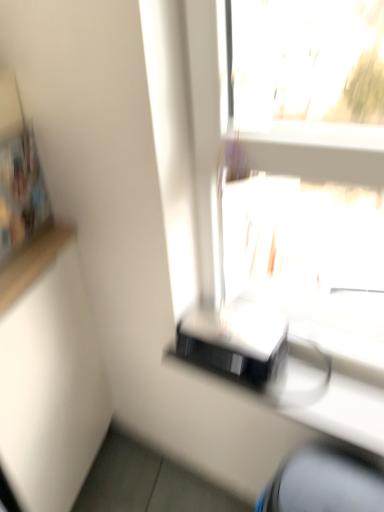
Describe the element at coordinates (346, 413) in the screenshot. I see `black glossy printer at lower right` at that location.

I want to click on black glossy printer at lower right, so [x=346, y=413].

Measure the distance between black glossy printer at lower right and camera.

They are 36.99 inches apart.

What do you see at coordinates (324, 483) in the screenshot? I see `blue fabric computer chair at lower right` at bounding box center [324, 483].

Where is `blue fabric computer chair at lower right`? blue fabric computer chair at lower right is located at coordinates (324, 483).

You are a GUI agent. You are given a task and a screenshot of the screen. Output one action in this format:
    pyautogui.click(x=<x>, y=<y>)
    Task: Click on the black glossy printer at lower right
    
    Given the screenshot: What is the action you would take?
    pyautogui.click(x=346, y=413)

Which is more to the left, blue fabric computer chair at lower right or black glossy printer at lower right?

black glossy printer at lower right.

Is blue fabric computer chair at lower right in front of or behind black glossy printer at lower right in the image?

Clearly, blue fabric computer chair at lower right is in front of black glossy printer at lower right.

Which point is more distant from viewer, [315,469] or [335,409]?

The point [335,409] is farther from the camera.

From the image's perspective, which one is positioned higher, blue fabric computer chair at lower right or black glossy printer at lower right?

From the image's view, black glossy printer at lower right is above.

From a real-world perspective, which object rests below the other?

From a 3D spatial view, blue fabric computer chair at lower right is below.

Does blue fabric computer chair at lower right have a greater width compared to black glossy printer at lower right?

Yes.

Who is taller, blue fabric computer chair at lower right or black glossy printer at lower right?

With more height is blue fabric computer chair at lower right.

Who is bigger, blue fabric computer chair at lower right or black glossy printer at lower right?

blue fabric computer chair at lower right is bigger.

Which is correct: blue fabric computer chair at lower right is inside black glossy printer at lower right, or outside of it?

blue fabric computer chair at lower right cannot be found inside black glossy printer at lower right.

Can you see blue fabric computer chair at lower right touching black glossy printer at lower right?

blue fabric computer chair at lower right and black glossy printer at lower right are clearly separated.

Looking at this image, is blue fabric computer chair at lower right oriented towards black glossy printer at lower right?

No, blue fabric computer chair at lower right is not oriented towards black glossy printer at lower right.

What's the angular difference between blue fabric computer chair at lower right and black glossy printer at lower right's facing directions?

The facing directions of blue fabric computer chair at lower right and black glossy printer at lower right are 0.679 degrees apart.

This screenshot has height=512, width=384. I want to click on computer chair below the black glossy printer at lower right (from the image's perspective), so click(324, 483).

Would you say black glossy printer at lower right is to the left or to the right of blue fabric computer chair at lower right in the picture?

Based on their positions, black glossy printer at lower right is located to the left of blue fabric computer chair at lower right.

Between black glossy printer at lower right and blue fabric computer chair at lower right, which one is positioned in front?

blue fabric computer chair at lower right is closer to the camera.

Considering the points (173, 358) and (303, 461), which point is behind, point (173, 358) or point (303, 461)?

The point (173, 358) is behind.

From the image's perspective, between black glossy printer at lower right and blue fabric computer chair at lower right, who is located below?

blue fabric computer chair at lower right.

From a real-world perspective, is black glossy printer at lower right on top of blue fabric computer chair at lower right?

Indeed, from a real-world perspective, black glossy printer at lower right stands above blue fabric computer chair at lower right.

Does black glossy printer at lower right have a lesser width compared to blue fabric computer chair at lower right?

Yes, black glossy printer at lower right is thinner than blue fabric computer chair at lower right.

Which of these two, black glossy printer at lower right or blue fabric computer chair at lower right, stands taller?

Standing taller between the two is blue fabric computer chair at lower right.

Is black glossy printer at lower right smaller than blue fabric computer chair at lower right?

Indeed, black glossy printer at lower right has a smaller size compared to blue fabric computer chair at lower right.

Is blue fabric computer chair at lower right completely or partially inside black glossy printer at lower right?

No, black glossy printer at lower right does not contain blue fabric computer chair at lower right.

Are black glossy printer at lower right and blue fabric computer chair at lower right located far from each other?

No.

Is black glossy printer at lower right looking in the opposite direction of blue fabric computer chair at lower right?

No, black glossy printer at lower right is not facing away from blue fabric computer chair at lower right.

This screenshot has height=512, width=384. I want to click on computer chair below the black glossy printer at lower right (from the image's perspective), so click(x=324, y=483).

Identify the location of computer chair below the black glossy printer at lower right (from a real-world perspective). (324, 483).

Where is `counter behind the blue fabric computer chair at lower right`? This screenshot has height=512, width=384. counter behind the blue fabric computer chair at lower right is located at coordinates (346, 413).